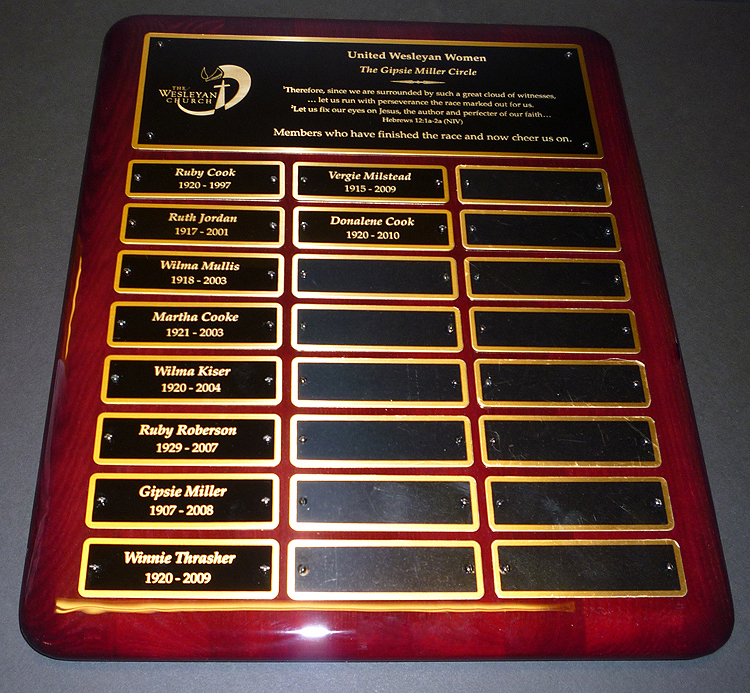
At what (x,y) coordinates should I click in order to perform the action: click on wooden plaque. Please return your answer as a coordinate pair (x, y). This screenshot has width=750, height=693. Looking at the image, I should click on (109, 181), (645, 249), (427, 633), (351, 26).